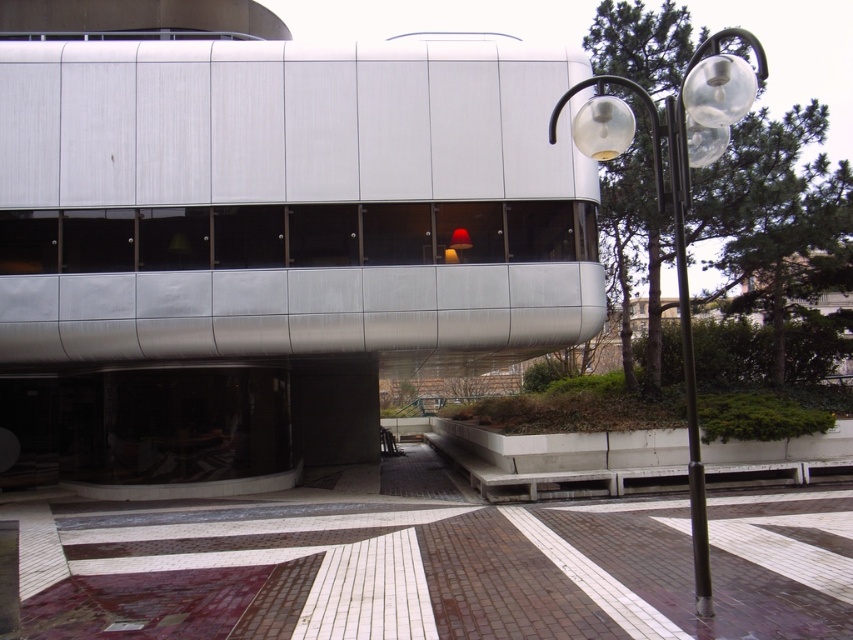
In order to click on clear glass lamp post at right in this screenshot , I will do `click(677, 195)`.

Can you confirm if brown brick pavement at center is positioned below black metal pole at right?

Yes.

At what (x,y) coordinates should I click in order to perform the action: click on brown brick pavement at center. Please return your answer as a coordinate pair (x, y). The width and height of the screenshot is (853, 640). Looking at the image, I should click on (424, 568).

Who is taller, brown brick pavement at center or clear glass lamp post at right?

Standing taller between the two is clear glass lamp post at right.

Between point (15, 588) and point (764, 74), which one is positioned behind?

The point (764, 74) is more distant.

Which is behind, point (204, 586) or point (722, 61)?

Point (204, 586)

This screenshot has height=640, width=853. I want to click on brown brick pavement at center, so click(424, 568).